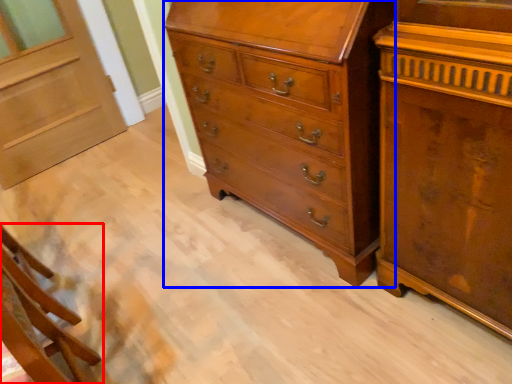
Question: Among these objects, which one is farthest to the camera, furniture (highlighted by a red box) or chest of drawers (highlighted by a blue box)?

Choices:
 (A) furniture
 (B) chest of drawers

Answer: (B)